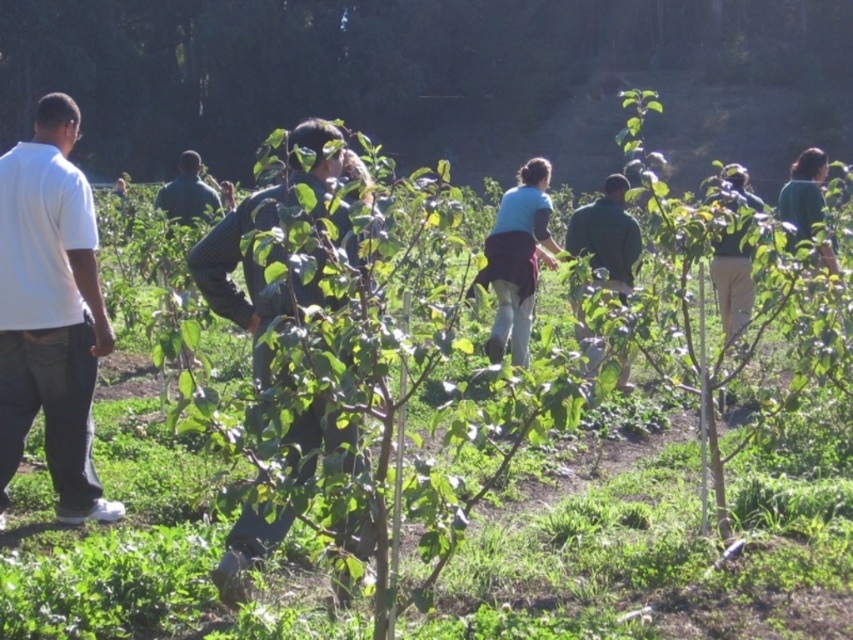
Question: Which object is the closest to the white cotton shirt at left?

Choices:
 (A) dark blue jeans at center
 (B) green matte shirt at center

Answer: (A)

Question: Can you confirm if white cotton shirt at left is positioned to the right of green matte shirt at center?

Choices:
 (A) no
 (B) yes

Answer: (A)

Question: Is white cotton shirt at left positioned before dark blue jeans at center?

Choices:
 (A) yes
 (B) no

Answer: (B)

Question: Can you confirm if dark blue jeans at center is smaller than green matte shirt at center?

Choices:
 (A) no
 (B) yes

Answer: (B)

Question: Which object is closer to the camera taking this photo?

Choices:
 (A) green leafy tree at center
 (B) dark green shirt at center

Answer: (B)

Question: Which of these objects is positioned farthest from the white cotton shirt at left?

Choices:
 (A) green matte shirt at center
 (B) dark blue jeans at center

Answer: (A)